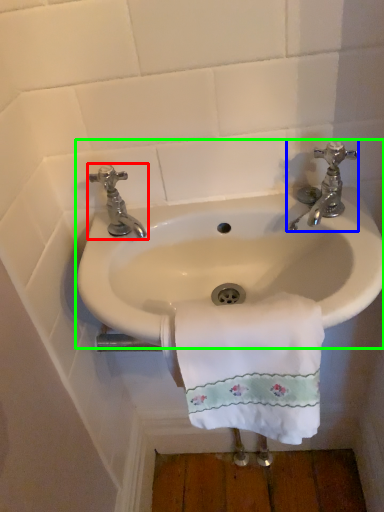
Question: Estimate the real-world distances between objects in this image. Which object is farther from tap (highlighted by a red box), tap (highlighted by a blue box) or sink (highlighted by a green box)?

Choices:
 (A) tap
 (B) sink

Answer: (A)